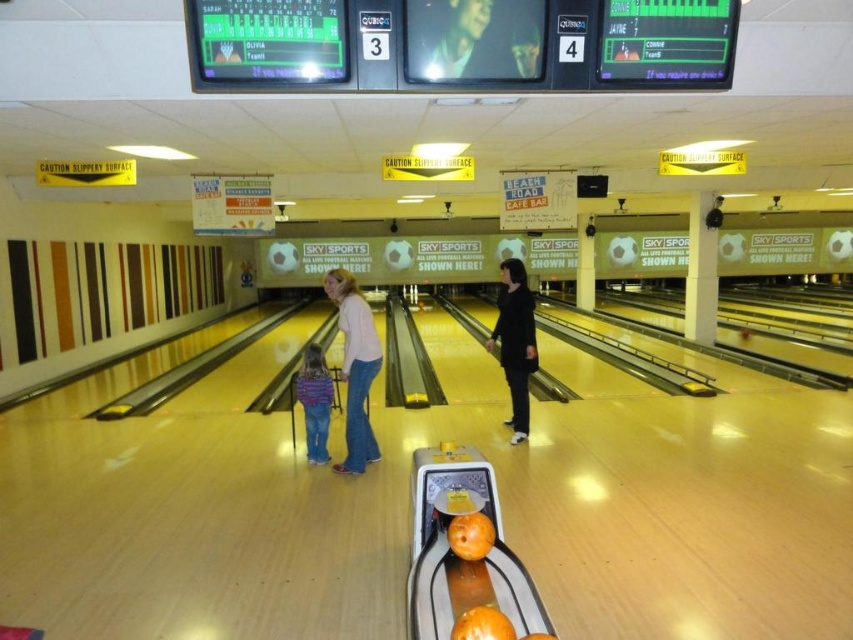
Question: Does black matte jacket at center come in front of striped fabric shirt at center?

Choices:
 (A) yes
 (B) no

Answer: (B)

Question: Which object is the closest to the striped fabric shirt at center?

Choices:
 (A) black matte jacket at center
 (B) matte pink sweater at center

Answer: (B)

Question: Considering the real-world distances, which object is closest to the smooth skin face at upper center?

Choices:
 (A) black matte jacket at center
 (B) matte pink sweater at center

Answer: (B)

Question: Does smooth skin face at upper center have a lesser width compared to matte pink sweater at center?

Choices:
 (A) no
 (B) yes

Answer: (A)

Question: From the image, what is the correct spatial relationship of matte pink sweater at center in relation to striped fabric shirt at center?

Choices:
 (A) right
 (B) left

Answer: (A)

Question: Which point is farther to the camera?

Choices:
 (A) (363, 304)
 (B) (479, 54)
 (C) (318, 352)
 (D) (527, 340)

Answer: (D)